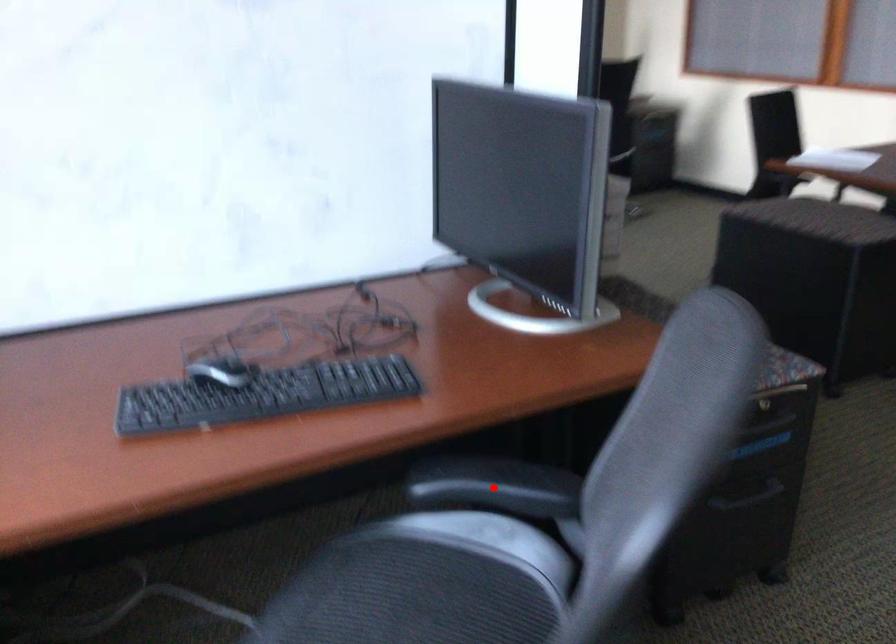
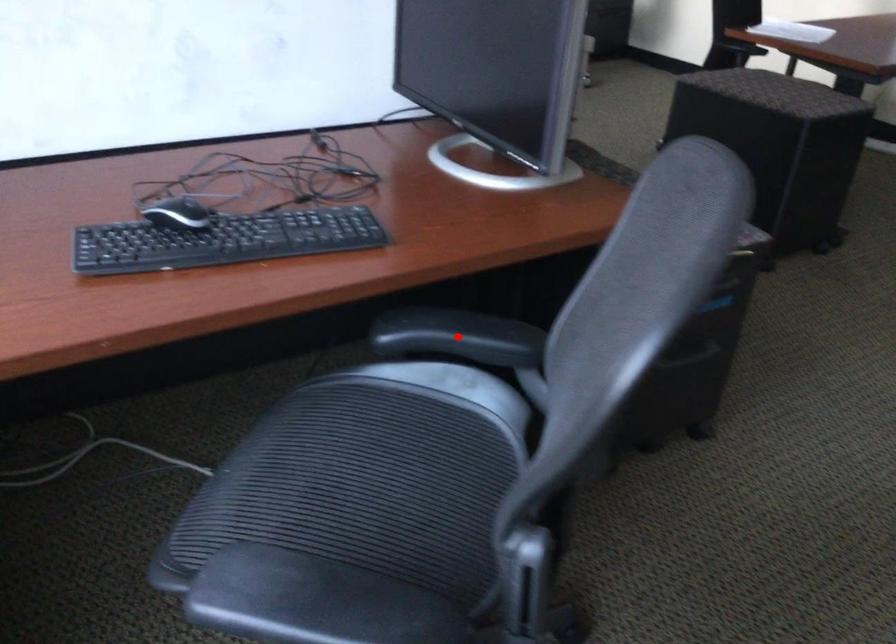
I am providing you with two images of the same scene from different viewpoints. A red point is marked on the first image and another point is marked on the second image. Are the points marked in image1 and image2 representing the same 3D position?

Yes